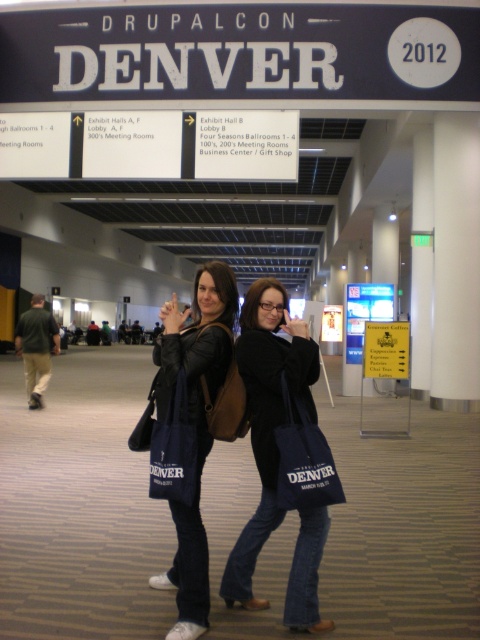
Does matte black jacket at center appear on the right side of dark blue canvas bag at center?

Incorrect, matte black jacket at center is not on the right side of dark blue canvas bag at center.

Does matte black jacket at center lie behind dark blue canvas bag at center?

Yes, it is behind dark blue canvas bag at center.

What do you see at coordinates (194, 416) in the screenshot?
I see `matte black jacket at center` at bounding box center [194, 416].

This screenshot has height=640, width=480. In order to click on matte black jacket at center in this screenshot , I will do `click(194, 416)`.

Which is behind, point (303, 620) or point (205, 451)?

Point (205, 451)

Does matte black tote bag at center have a greater height compared to matte black jacket at center?

Incorrect, matte black tote bag at center's height is not larger of matte black jacket at center's.

Is point (250, 332) more distant than point (224, 296)?

No, it is in front of (224, 296).

The image size is (480, 640). In order to click on matte black tote bag at center in this screenshot , I will do `click(266, 417)`.

Is point (244, 339) more distant than point (284, 502)?

Yes, point (244, 339) is behind point (284, 502).

Between matte black tote bag at center and dark blue canvas bag at center, which one has less height?

dark blue canvas bag at center

The height and width of the screenshot is (640, 480). In order to click on matte black tote bag at center in this screenshot , I will do `click(266, 417)`.

This screenshot has height=640, width=480. Find the location of `matte black tote bag at center`. matte black tote bag at center is located at coordinates (266, 417).